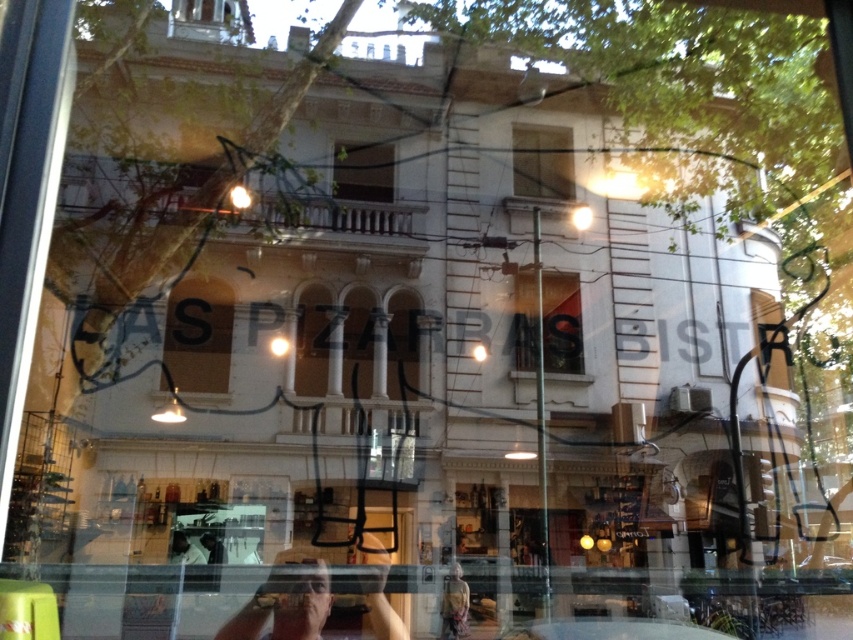
Can you confirm if matte wood sign at center is smaller than clear glass window at upper center?

No.

Which is more to the left, matte wood sign at center or clear glass window at upper center?

matte wood sign at center

What do you see at coordinates (199, 333) in the screenshot?
I see `matte wood sign at center` at bounding box center [199, 333].

Locate an element on the screen. matte wood sign at center is located at coordinates (199, 333).

Does matte black phone at center have a lesser width compared to transparent glass window at center?

Yes.

Measure the distance between matte black phone at center and camera.

23.10 feet

Is point (291, 580) farther from camera compared to point (552, 273)?

No, it is not.

The height and width of the screenshot is (640, 853). Identify the location of matte black phone at center. point(286,602).

Is point (200, 355) positioned in front of point (351, 157)?

Yes.

Who is taller, matte wood sign at center or clear glass window at center?

matte wood sign at center is taller.

Find the location of a particular element. The height and width of the screenshot is (640, 853). matte wood sign at center is located at coordinates (199, 333).

This screenshot has height=640, width=853. I want to click on matte wood sign at center, so click(199, 333).